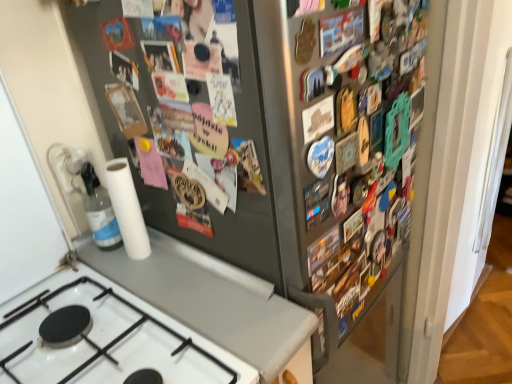
Measure the distance between point (x=312, y=105) and camera.

A distance of 25.43 inches exists between point (x=312, y=105) and camera.

The image size is (512, 384). I want to click on matte plastic photo frame at upper center, which is counted as the 2th button, starting from the bottom, so 160,56.

I want to click on metallic button at upper center, the first button when ordered from top to bottom, so click(341, 31).

What are the coordinates of `refrigerator below the metallic button at upper center, which ranks as the 3th button in left-to-right order (from the image's perspective)` in the screenshot? It's located at (269, 137).

From a real-world perspective, which object stands above the other?

From a 3D spatial view, metallic button at upper center, which ranks as the third button in bottom-to-top order, is above.

Which of these two, satin finish fridge at upper right or metallic button at upper center, acting as the 1th button starting from the right, is smaller?

With smaller size is metallic button at upper center, acting as the 1th button starting from the right.

How far apart are satin finish fridge at upper right and metallic button at upper center, acting as the 1th button starting from the right?

satin finish fridge at upper right and metallic button at upper center, acting as the 1th button starting from the right, are 12.68 inches apart.

From a real-world perspective, does satin finish fridge at upper right stand above metallic gray refrigerator at left?

Actually, satin finish fridge at upper right is physically below metallic gray refrigerator at left in the real world.

From the image's perspective, is satin finish fridge at upper right beneath metallic gray refrigerator at left?

Indeed, from the image's perspective, satin finish fridge at upper right is shown beneath metallic gray refrigerator at left.

Between satin finish fridge at upper right and metallic gray refrigerator at left, which one appears on the right side from the viewer's perspective?

From the viewer's perspective, satin finish fridge at upper right appears more on the right side.

Is satin finish fridge at upper right aimed at metallic gray refrigerator at left?

No, satin finish fridge at upper right does not turn towards metallic gray refrigerator at left.

Considering the sizes of objects transparent plastic bottle at lower left and white glossy gas stove at lower left in the image provided, who is bigger, transparent plastic bottle at lower left or white glossy gas stove at lower left?

With larger size is white glossy gas stove at lower left.

Considering the sizes of transparent plastic bottle at lower left and white glossy gas stove at lower left in the image, is transparent plastic bottle at lower left wider or thinner than white glossy gas stove at lower left?

In the image, transparent plastic bottle at lower left appears to be more narrow than white glossy gas stove at lower left.

Is transparent plastic bottle at lower left further to the viewer compared to white glossy gas stove at lower left?

Yes.

Could you measure the distance between transparent plastic bottle at lower left and white glossy gas stove at lower left?

The distance of transparent plastic bottle at lower left from white glossy gas stove at lower left is 10.15 inches.

Is point (326, 20) closer or farther from the camera than point (28, 370)?

Point (326, 20).

In order to click on the 3rd button to the right of the white glossy gas stove at lower left, counting from the anchor's position in this screenshot , I will do `click(341, 31)`.

Which of these two, metallic button at upper center, which ranks as the third button in bottom-to-top order, or white glossy gas stove at lower left, stands shorter?

Standing shorter between the two is metallic button at upper center, which ranks as the third button in bottom-to-top order.

Consider the image. From the image's perspective, is matte plastic photo frame at upper center, the 1th button viewed from the left, above or below metallic button at upper center, the 2th button when ordered from right to left?

From the image's perspective, matte plastic photo frame at upper center, the 1th button viewed from the left, appears above metallic button at upper center, the 2th button when ordered from right to left.

From their relative heights in the image, would you say matte plastic photo frame at upper center, which is the third button from right to left, is taller or shorter than metallic button at upper center, the 2th button when ordered from right to left?

matte plastic photo frame at upper center, which is the third button from right to left, is taller than metallic button at upper center, the 2th button when ordered from right to left.

Which object is positioned more to the right, matte plastic photo frame at upper center, arranged as the second button when viewed from the top, or metallic button at upper center, the 2th button when ordered from right to left?

metallic button at upper center, the 2th button when ordered from right to left, is more to the right.

Can you tell me how much matte plastic photo frame at upper center, the 1th button viewed from the left, and metallic button at upper center, which is the 3th button in top-to-bottom order, differ in facing direction?

They differ by 88.7 degrees in their facing directions.

From the picture: From a real-world perspective, is metallic gray refrigerator at left physically located above or below satin finish fridge at upper right?

metallic gray refrigerator at left is situated higher than satin finish fridge at upper right in the real world.

Considering their positions, is metallic gray refrigerator at left located in front of or behind satin finish fridge at upper right?

metallic gray refrigerator at left is behind satin finish fridge at upper right.

Can you confirm if metallic gray refrigerator at left is positioned to the left of satin finish fridge at upper right?

Yes, metallic gray refrigerator at left is to the left of satin finish fridge at upper right.

Is metallic button at upper center, which ranks as the third button in bottom-to-top order, not near metallic button at upper center, which is the second button in left-to-right order?

No.

Who is more distant, metallic button at upper center, acting as the 1th button starting from the right, or metallic button at upper center, the 2th button when ordered from right to left?

metallic button at upper center, the 2th button when ordered from right to left, is further away from the camera.

From the image's perspective, is metallic button at upper center, the first button when ordered from top to bottom, on metallic button at upper center, which is the 3th button in top-to-bottom order?

Yes, from the image's perspective, metallic button at upper center, the first button when ordered from top to bottom, is on top of metallic button at upper center, which is the 3th button in top-to-bottom order.

Locate an element on the screen. The image size is (512, 384). refrigerator below the metallic button at upper center, which ranks as the 3th button in left-to-right order (from the image's perspective) is located at coordinates (269, 137).

You are a GUI agent. You are given a task and a screenshot of the screen. Output one action in this format:
    pyautogui.click(x=<x>, y=<y>)
    Task: Click on the refrigerator in front of the metallic gray refrigerator at left
    The height and width of the screenshot is (384, 512).
    Given the screenshot: What is the action you would take?
    pyautogui.click(x=269, y=137)

Consider the image. Based on their spatial positions, is metallic gray refrigerator at left or transparent plastic bottle at lower left closer to white glossy gas stove at lower left?

transparent plastic bottle at lower left is positioned closer to the anchor white glossy gas stove at lower left.

Based on the photo, which object lies nearer to the anchor point transparent plastic bottle at lower left, matte plastic photo frame at upper center, which is the third button from right to left, or metallic gray refrigerator at left?

metallic gray refrigerator at left is closer to transparent plastic bottle at lower left.

Estimate the real-world distances between objects in this image. Which object is closer to metallic button at upper center, which ranks as the third button in bottom-to-top order, metallic button at upper center, which is the second button in left-to-right order, or white matte countertop at center?

Among the two, metallic button at upper center, which is the second button in left-to-right order, is located nearer to metallic button at upper center, which ranks as the third button in bottom-to-top order.

In the scene shown: Which object lies nearer to the anchor point satin finish fridge at upper right, white matte countertop at center or white glossy gas stove at lower left?

Among the two, white matte countertop at center is located nearer to satin finish fridge at upper right.

When comparing their distances from metallic gray refrigerator at left, does white matte countertop at center or metallic button at upper center, acting as the 1th button starting from the right, seem further?

metallic button at upper center, acting as the 1th button starting from the right, lies further to metallic gray refrigerator at left than the other object.

Estimate the real-world distances between objects in this image. Which object is further from matte plastic photo frame at upper center, which is counted as the 2th button, starting from the bottom, transparent plastic bottle at lower left or metallic button at upper center, acting as the 1th button starting from the right?

transparent plastic bottle at lower left.

Which object lies nearer to the anchor point satin finish fridge at upper right, metallic button at upper center, the 2th button when ordered from right to left, or matte plastic photo frame at upper center, the 1th button viewed from the left?

Based on the image, metallic button at upper center, the 2th button when ordered from right to left, appears to be nearer to satin finish fridge at upper right.

Estimate the real-world distances between objects in this image. Which object is closer to transparent plastic bottle at lower left, metallic gray refrigerator at left or metallic button at upper center, acting as the 1th button starting from the right?

The object closer to transparent plastic bottle at lower left is metallic gray refrigerator at left.

Identify the location of button between matte plastic photo frame at upper center, which is counted as the 2th button, starting from the bottom, and white matte countertop at center from top to bottom. (318, 119).

In order to click on button between metallic gray refrigerator at left and white glossy gas stove at lower left in the vertical direction in this screenshot , I will do `click(318, 119)`.

Identify the location of counter top between white glossy gas stove at lower left and satin finish fridge at upper right in the horizontal direction. The image size is (512, 384). (210, 299).

You are a GUI agent. You are given a task and a screenshot of the screen. Output one action in this format:
    pyautogui.click(x=<x>, y=<y>)
    Task: Click on the refrigerator between metallic button at upper center, acting as the 1th button starting from the right, and white matte countertop at center vertically
    The height and width of the screenshot is (384, 512).
    Given the screenshot: What is the action you would take?
    pyautogui.click(x=269, y=137)